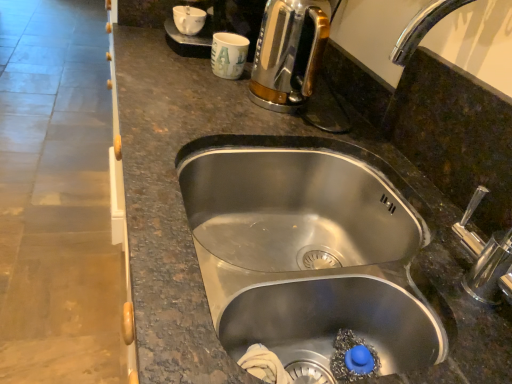
Question: Does shiny metallic kettle at upper right appear on the left side of stainless steel sink at center?

Choices:
 (A) no
 (B) yes

Answer: (B)

Question: From a real-world perspective, is shiny metallic kettle at upper right beneath stainless steel sink at center?

Choices:
 (A) yes
 (B) no

Answer: (B)

Question: Can you confirm if shiny metallic kettle at upper right is taller than stainless steel sink at center?

Choices:
 (A) yes
 (B) no

Answer: (A)

Question: From a real-world perspective, is shiny metallic kettle at upper right on stainless steel sink at center?

Choices:
 (A) no
 (B) yes

Answer: (B)

Question: Is stainless steel sink at center completely or partially inside shiny metallic kettle at upper right?

Choices:
 (A) no
 (B) yes

Answer: (A)

Question: Is point (223, 56) positioned closer to the camera than point (202, 16)?

Choices:
 (A) closer
 (B) farther

Answer: (A)

Question: Looking at their shapes, would you say white paper cup at upper center, which ranks as the 2th coffee cup in left-to-right order, is wider or thinner than white glossy coffee cup at upper center, which appears as the second coffee cup when ordered from the bottom?

Choices:
 (A) wide
 (B) thin

Answer: (A)

Question: From the image's perspective, is white paper cup at upper center, the second coffee cup positioned from the top, located above or below white glossy coffee cup at upper center, which appears as the second coffee cup when ordered from the bottom?

Choices:
 (A) above
 (B) below

Answer: (B)

Question: Based on their sizes in the image, would you say white paper cup at upper center, acting as the 1th coffee cup starting from the right, is bigger or smaller than white glossy coffee cup at upper center, marked as the 2th coffee cup in a right-to-left arrangement?

Choices:
 (A) big
 (B) small

Answer: (A)

Question: From a real-world perspective, is shiny metallic kettle at upper right above or below white glossy coffee cup at upper center, which is the 1th coffee cup in left-to-right order?

Choices:
 (A) above
 (B) below

Answer: (A)

Question: Considering the positions of shiny metallic kettle at upper right and white glossy coffee cup at upper center, which appears as the second coffee cup when ordered from the bottom, in the image, is shiny metallic kettle at upper right taller or shorter than white glossy coffee cup at upper center, which appears as the second coffee cup when ordered from the bottom,?

Choices:
 (A) short
 (B) tall

Answer: (B)

Question: Is shiny metallic kettle at upper right inside or outside of white glossy coffee cup at upper center, marked as the 2th coffee cup in a right-to-left arrangement?

Choices:
 (A) outside
 (B) inside

Answer: (A)

Question: In the image, is shiny metallic kettle at upper right on the left side or the right side of white glossy coffee cup at upper center, which is the 1th coffee cup in left-to-right order?

Choices:
 (A) right
 (B) left

Answer: (A)

Question: In terms of width, does white glossy coffee cup at upper center, which is the 1th coffee cup in left-to-right order, look wider or thinner when compared to white paper cup at upper center, acting as the 1th coffee cup starting from the right?

Choices:
 (A) thin
 (B) wide

Answer: (A)

Question: Is white glossy coffee cup at upper center, which appears as the second coffee cup when ordered from the bottom, spatially inside white paper cup at upper center, the first coffee cup ordered from the bottom, or outside of it?

Choices:
 (A) outside
 (B) inside

Answer: (A)